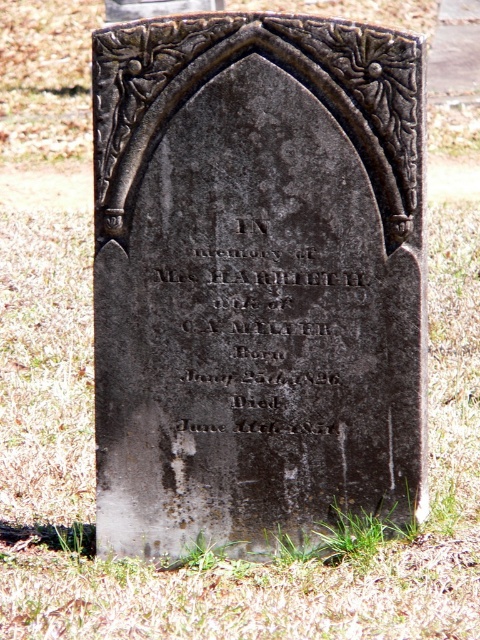
Question: Which of the following is the farthest from the observer?

Choices:
 (A) (141, 625)
 (B) (423, 372)
 (C) (195, 221)

Answer: (B)

Question: Can you confirm if gray stone gravestone at center is positioned to the left of green grass at center?

Choices:
 (A) yes
 (B) no

Answer: (B)

Question: Does green grass at center appear on the right side of black stone inscription at center?

Choices:
 (A) no
 (B) yes

Answer: (A)

Question: Which of the following is the closest to the observer?

Choices:
 (A) black stone inscription at center
 (B) gray stone gravestone at center

Answer: (B)

Question: Is gray stone gravestone at center above green grass at center?

Choices:
 (A) yes
 (B) no

Answer: (A)

Question: Which object is farther from the camera taking this photo?

Choices:
 (A) gray stone gravestone at center
 (B) black stone inscription at center
 (C) green grass at center

Answer: (B)